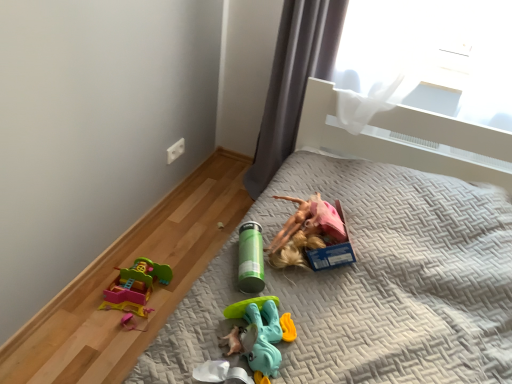
The width and height of the screenshot is (512, 384). Find the location of `vacant point to the left of gray fabric curtain at upper right`. vacant point to the left of gray fabric curtain at upper right is located at coordinates (218, 183).